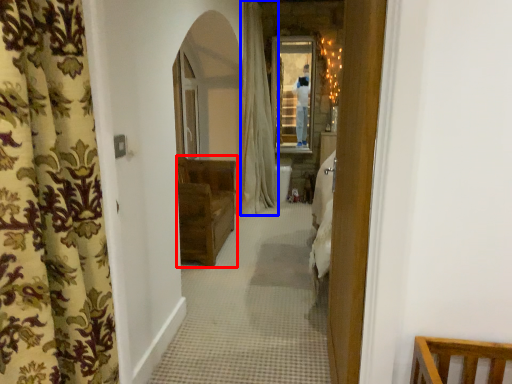
Question: Which object is further to the camera taking this photo, furniture (highlighted by a red box) or curtain (highlighted by a blue box)?

Choices:
 (A) furniture
 (B) curtain

Answer: (B)